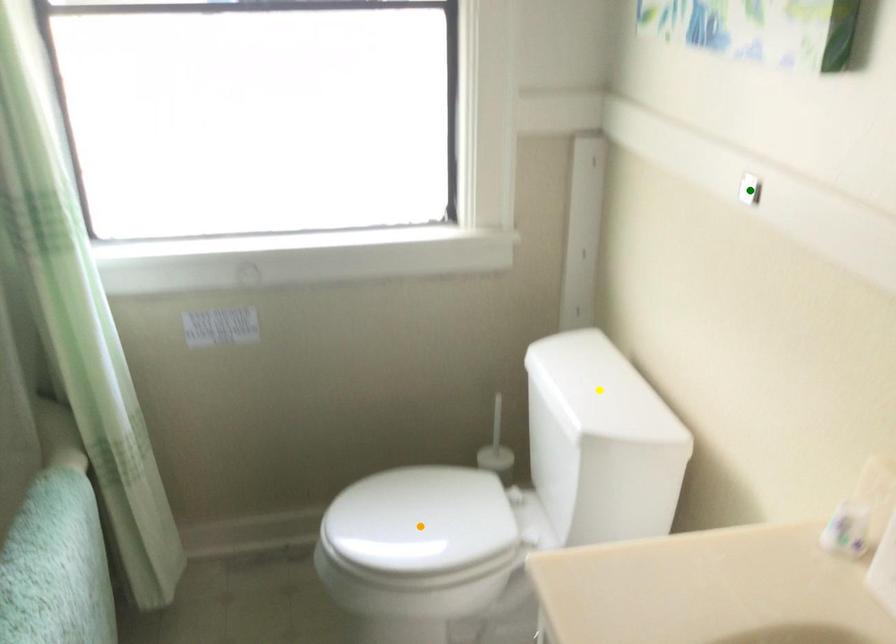
Order these from nearest to farthest:
orange point | green point | yellow point

green point, yellow point, orange point